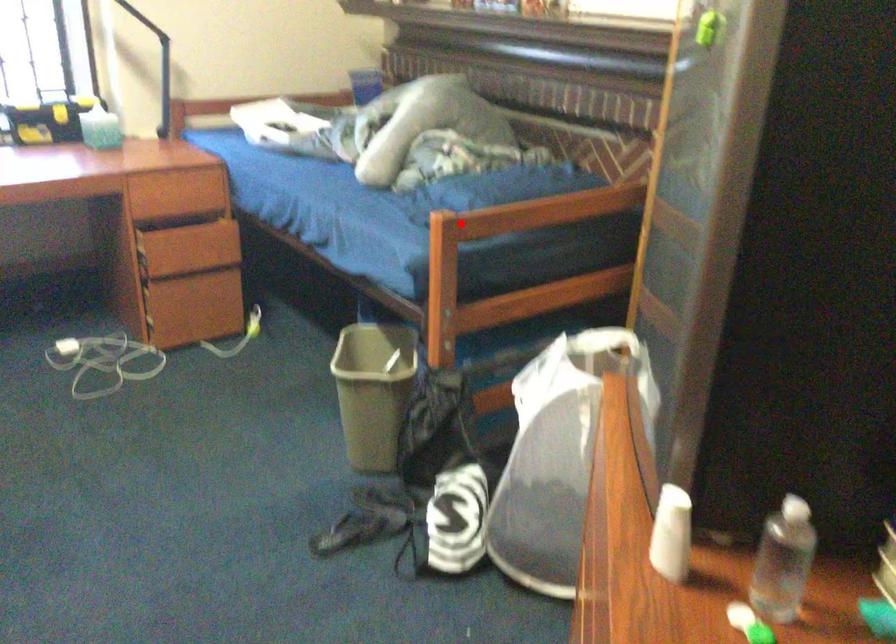
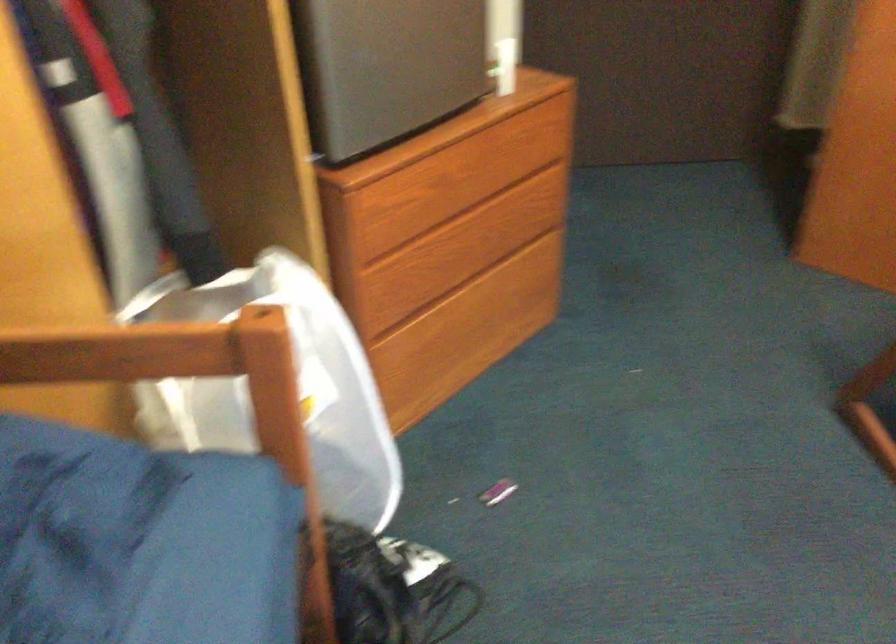
Where in the second image is the point corresponding to the highlighted location from the first image?

(73, 529)